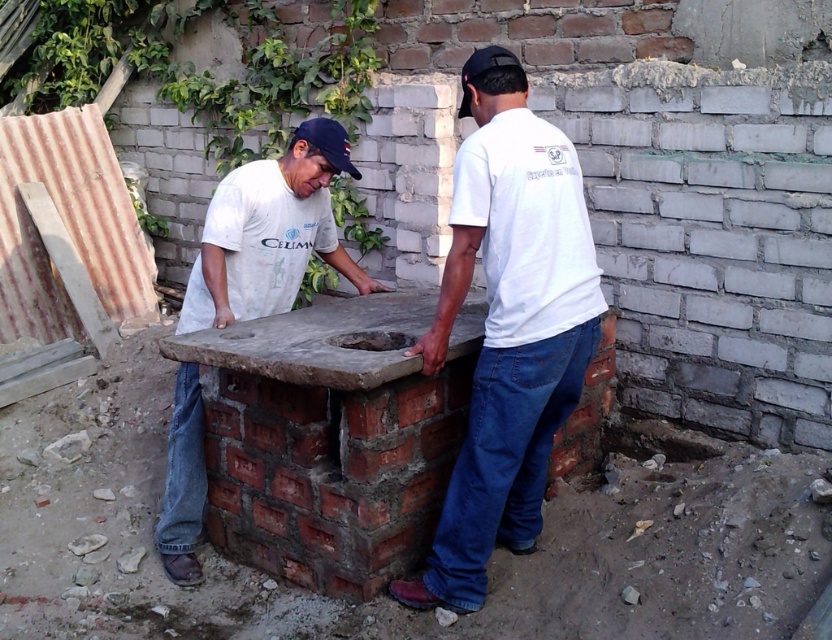
You are a construction inspector who needs to access the black fabric baseball cap at upper center. The matte concrete oven at center is blocking your path. Can you move the oven to reach the cap?

The matte concrete oven at center is in front of the black fabric baseball cap at upper center, so you cannot directly access the cap without moving the oven. However, moving such a heavy concrete structure might not be feasible. Consider checking if there is an alternative route or tool to reach the cap safely.

In the scene shown: You are an architect reviewing the construction site. You notice the matte concrete oven at center and the black fabric baseball cap at upper center. Which object is taller?

The matte concrete oven at center is much taller than the black fabric baseball cap at upper center.

You are a construction worker who needs to place a new brick on the structure. Given the size of the matte concrete oven at center and the black fabric baseball cap at upper center, which object would require more space to accommodate the brick placement?

The matte concrete oven at center has a larger size compared to the black fabric baseball cap at upper center, so it would require more space to accommodate the brick placement.